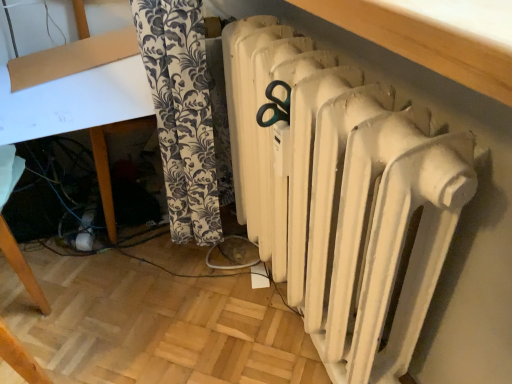
What do you see at coordinates (343, 200) in the screenshot? I see `white matte radiator at lower right` at bounding box center [343, 200].

Image resolution: width=512 pixels, height=384 pixels. In order to click on white matte radiator at lower right in this screenshot , I will do `click(343, 200)`.

Identify the location of white matte radiator at lower right. This screenshot has width=512, height=384. (343, 200).